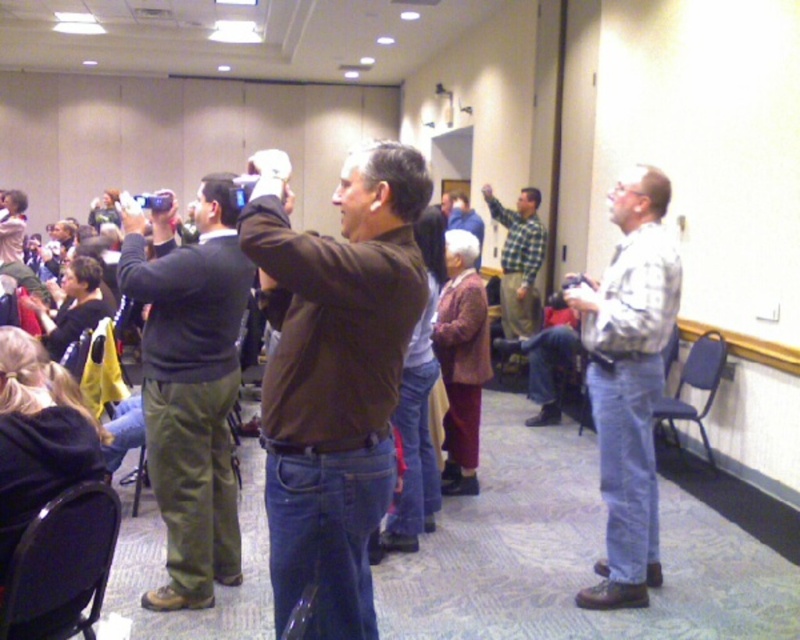
Question: Estimate the real-world distances between objects in this image. Which object is closer to the checkered fabric shirt at center?

Choices:
 (A) plaid shirt at right
 (B) dark green pants at center

Answer: (A)

Question: Estimate the real-world distances between objects in this image. Which object is closer to the checkered fabric shirt at center?

Choices:
 (A) brown matte jacket at center
 (B) plaid shirt at right
 (C) dark green pants at center

Answer: (B)

Question: Is plaid shirt at right wider than checkered fabric shirt at center?

Choices:
 (A) yes
 (B) no

Answer: (B)

Question: Can you confirm if dark green pants at center is smaller than plaid shirt at right?

Choices:
 (A) no
 (B) yes

Answer: (B)

Question: Estimate the real-world distances between objects in this image. Which object is closer to the checkered fabric shirt at center?

Choices:
 (A) dark green pants at center
 (B) brown matte jacket at center
 (C) plaid shirt at right

Answer: (C)

Question: Can you confirm if dark green pants at center is thinner than plaid shirt at right?

Choices:
 (A) no
 (B) yes

Answer: (A)